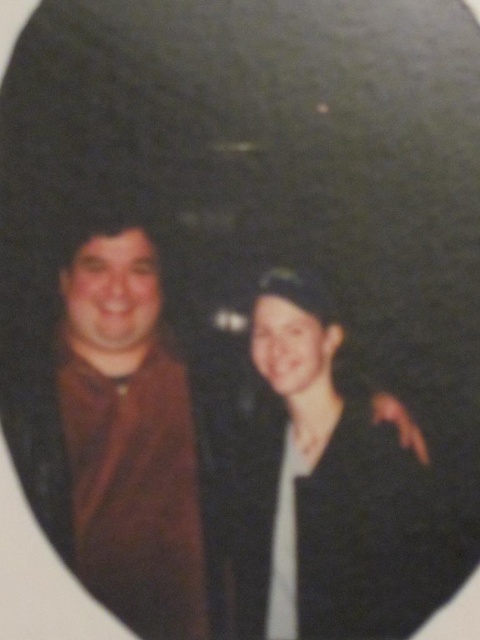
Question: Which of these objects is positioned closest to the matte black jacket at center?

Choices:
 (A) brown matte shirt at left
 (B) brown fabric couple at center

Answer: (B)

Question: Does brown fabric couple at center have a smaller size compared to brown matte shirt at left?

Choices:
 (A) no
 (B) yes

Answer: (A)

Question: Does brown fabric couple at center have a lesser width compared to matte black jacket at center?

Choices:
 (A) yes
 (B) no

Answer: (B)

Question: Which point appears farthest from the camera in this image?

Choices:
 (A) coord(330,618)
 (B) coord(86,525)

Answer: (B)

Question: Among these objects, which one is farthest from the camera?

Choices:
 (A) brown matte shirt at left
 (B) matte black jacket at center

Answer: (A)

Question: Is matte black jacket at center to the right of brown matte shirt at left from the viewer's perspective?

Choices:
 (A) yes
 (B) no

Answer: (A)